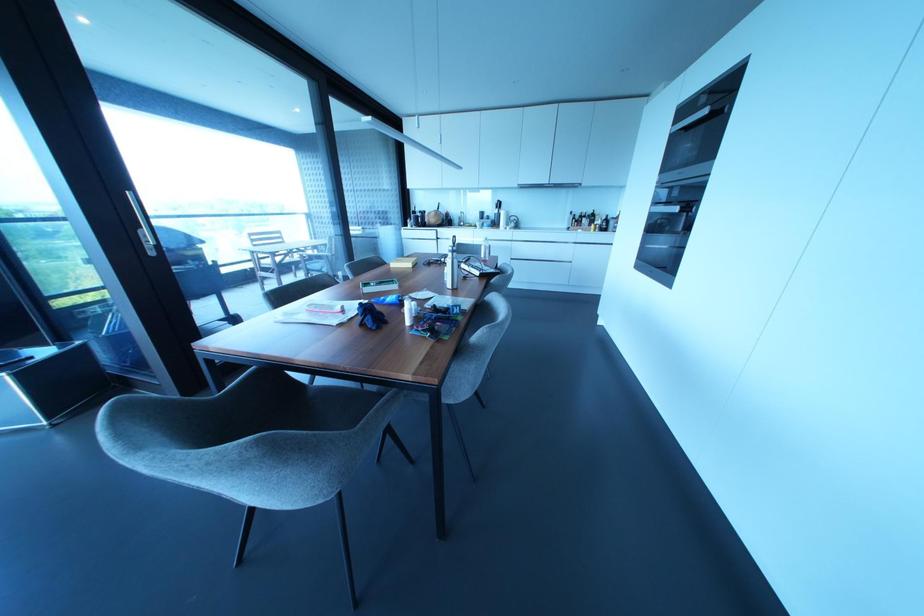
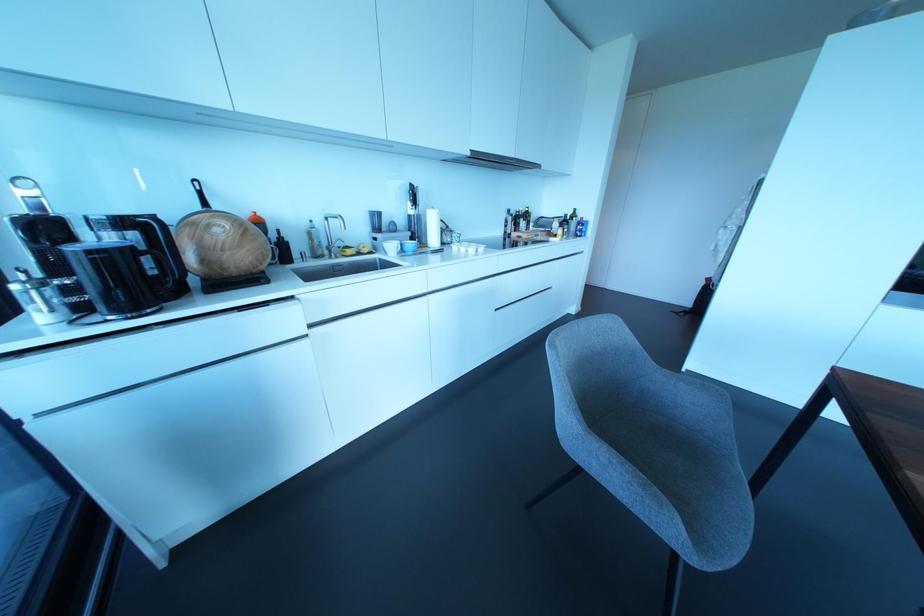
Locate, in the second image, the point that corresponds to point 495,211 in the first image.

(410, 211)